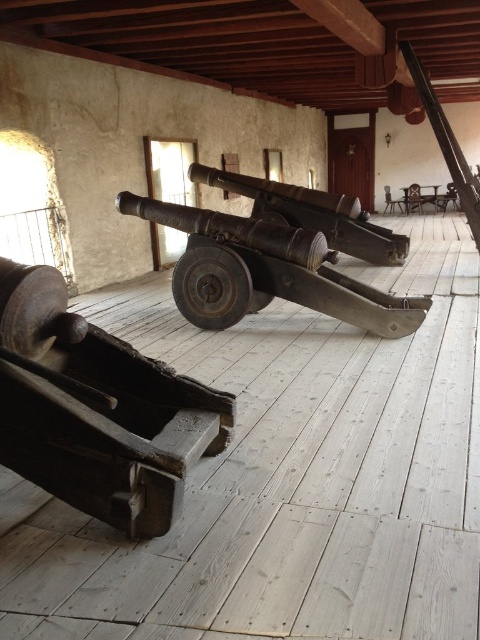
Question: Can you confirm if rusty metal cannon at lower left is positioned above rusty metal cannon at center?

Choices:
 (A) yes
 (B) no

Answer: (B)

Question: Which object appears closest to the camera in this image?

Choices:
 (A) rusty metal cannon at center
 (B) rusty metal cannon at lower left

Answer: (B)

Question: Is rusty metal cannon at lower left closer to the viewer compared to rusty metal cannon at center?

Choices:
 (A) no
 (B) yes

Answer: (B)

Question: Which of the following is the farthest from the observer?

Choices:
 (A) (151, 500)
 (B) (208, 234)

Answer: (B)

Question: Is rusty metal cannon at lower left above rusty metal cannon at center?

Choices:
 (A) no
 (B) yes

Answer: (A)

Question: Among these points, which one is farthest from the camera?

Choices:
 (A) (121, 413)
 (B) (189, 300)

Answer: (B)